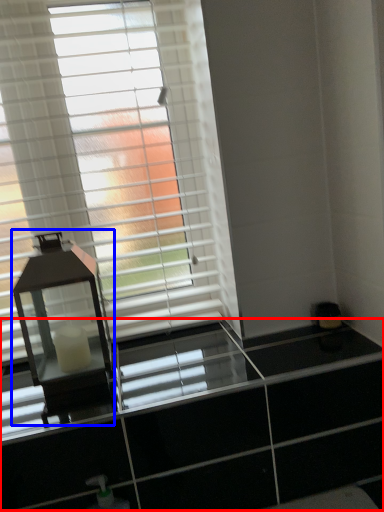
Question: Which object appears farthest to the camera in this image, dresser (highlighted by a red box) or table lamp (highlighted by a blue box)?

Choices:
 (A) dresser
 (B) table lamp

Answer: (B)